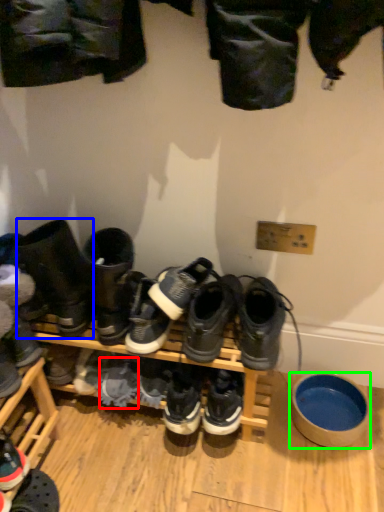
Question: Which is farther away from shoe (highlighted by a red box)? footwear (highlighted by a blue box) or bowl (highlighted by a green box)?

Choices:
 (A) footwear
 (B) bowl

Answer: (B)